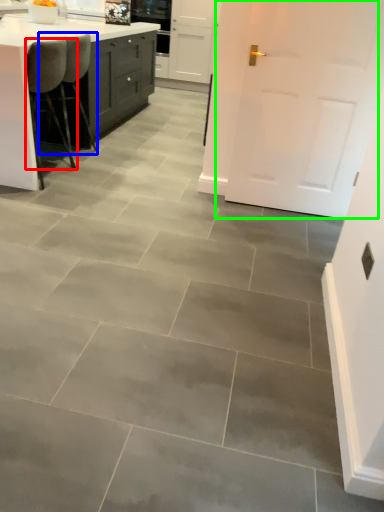
Question: Which object is the closest to the chair (highlighted by a red box)? Choose among these: chair (highlighted by a blue box) or door (highlighted by a green box).

Choices:
 (A) chair
 (B) door

Answer: (A)